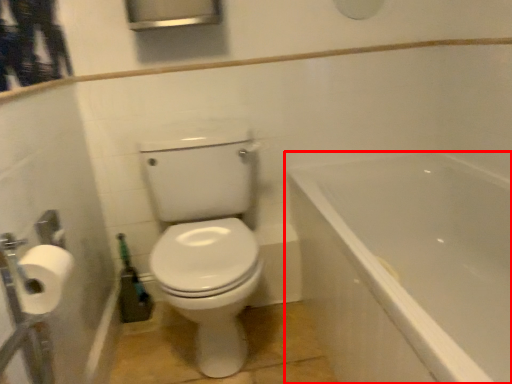
Question: Where is bathtub (annotated by the red box) located in relation to toilet paper in the image?

Choices:
 (A) right
 (B) left

Answer: (A)